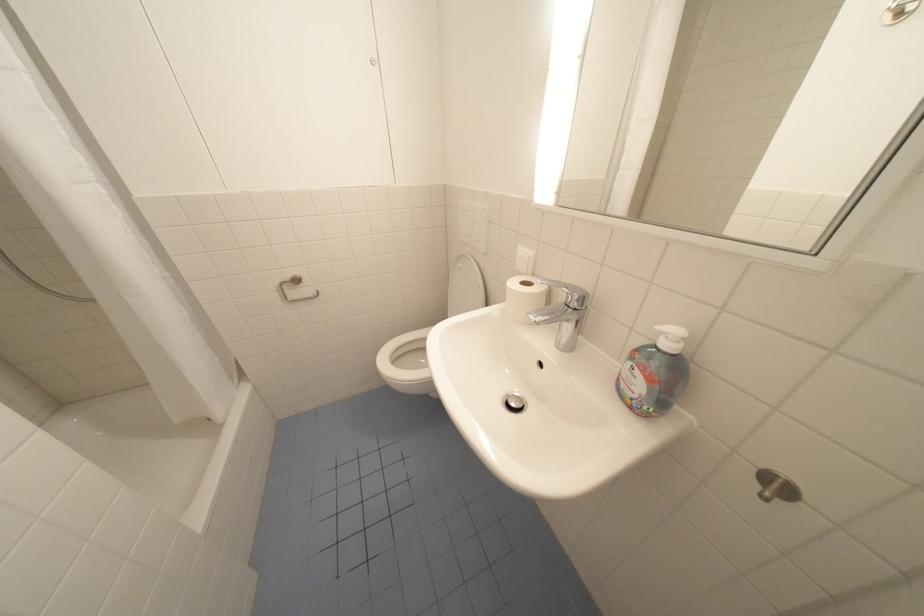
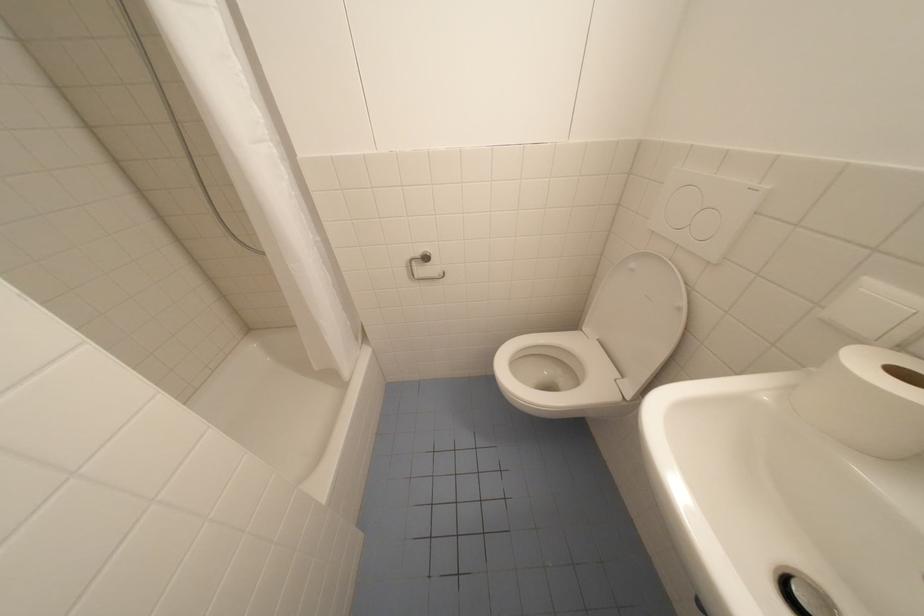
Question: The camera is either moving clockwise (left) or counter-clockwise (right) around the object. The first image is from the beginning of the video and the second image is from the end. Is the camera moving left or right when shooting the video?

Choices:
 (A) Left
 (B) Right

Answer: (B)